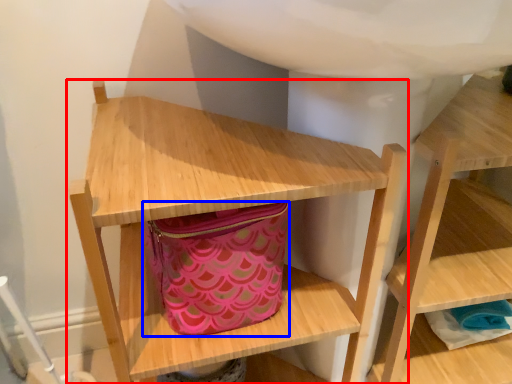
Question: Which of the following is the farthest to the observer, shelf (highlighted by a red box) or bag (highlighted by a blue box)?

Choices:
 (A) shelf
 (B) bag

Answer: (B)